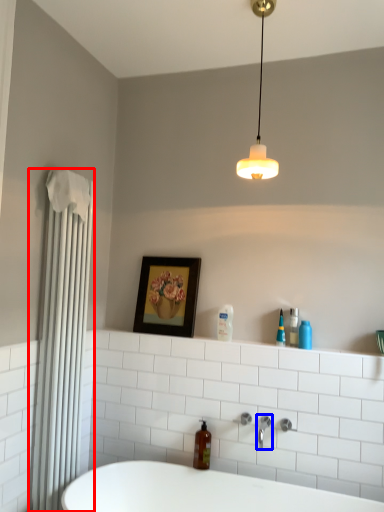
Question: Which object is further to the camera taking this photo, shower curtain (highlighted by a red box) or tap (highlighted by a blue box)?

Choices:
 (A) shower curtain
 (B) tap

Answer: (B)